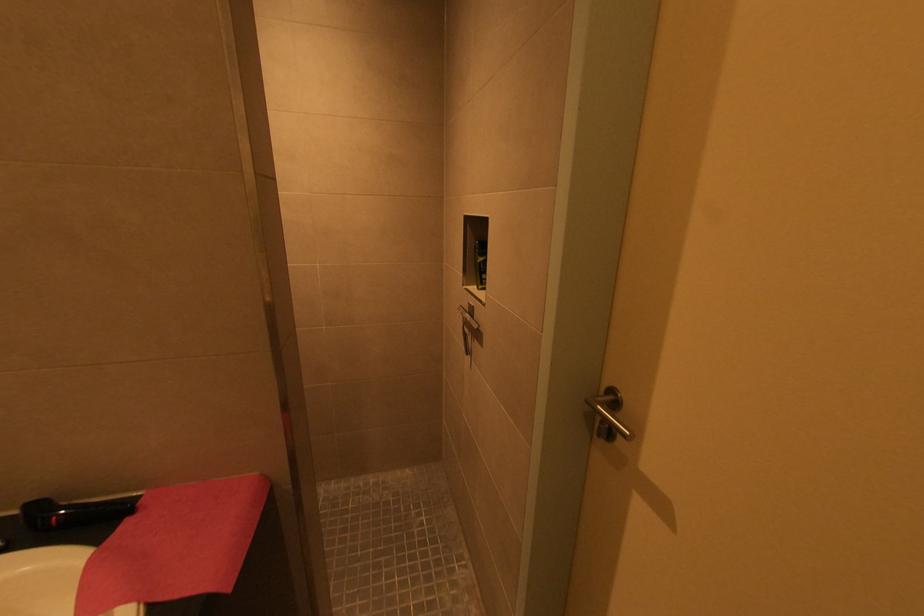
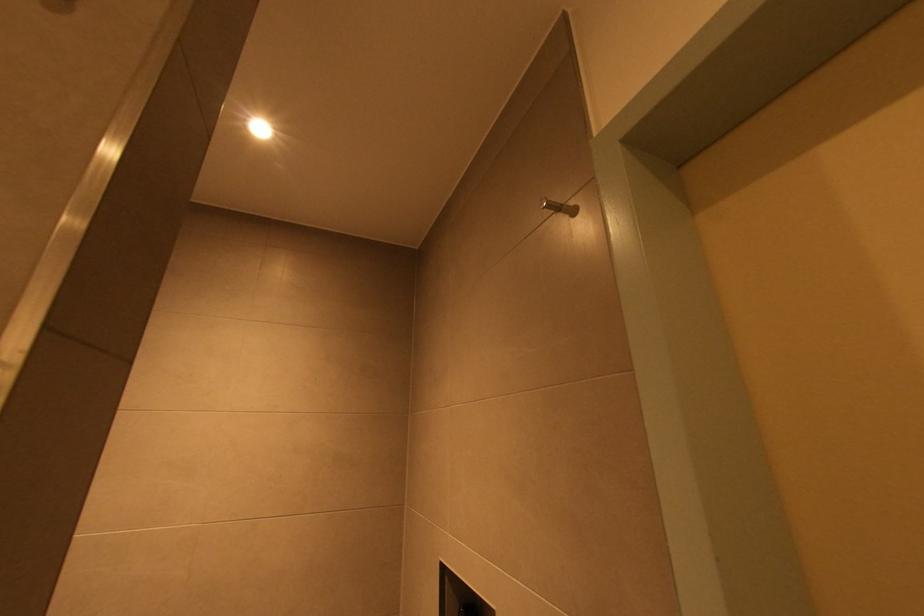
Question: The first image is from the beginning of the video and the second image is from the end. How did the camera likely rotate when shooting the video?

Choices:
 (A) Left
 (B) Right
 (C) Up
 (D) Down

Answer: (C)